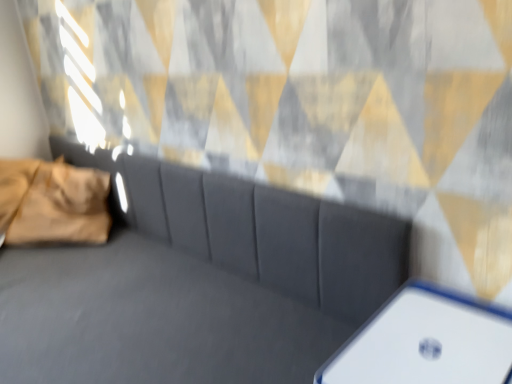
The height and width of the screenshot is (384, 512). What are the coordinates of `golden velvet pillow at left` in the screenshot? It's located at (53, 202).

In the image, is suede gray couch at center on the left side or the right side of white plastic phone at lower right?

suede gray couch at center is to the left of white plastic phone at lower right.

Is suede gray couch at center far from white plastic phone at lower right?

Actually, suede gray couch at center and white plastic phone at lower right are a little close together.

Which is correct: suede gray couch at center is inside white plastic phone at lower right, or outside of it?

suede gray couch at center cannot be found inside white plastic phone at lower right.

Who is shorter, suede gray couch at center or white plastic phone at lower right?

Standing shorter between the two is white plastic phone at lower right.

Considering the sizes of objects golden velvet pillow at left and suede gray couch at center in the image provided, who is bigger, golden velvet pillow at left or suede gray couch at center?

suede gray couch at center.

Considering the positions of objects golden velvet pillow at left and suede gray couch at center in the image provided, who is more to the right, golden velvet pillow at left or suede gray couch at center?

Positioned to the right is suede gray couch at center.

Which is more distant, (68, 193) or (206, 256)?

The point (68, 193) is behind.

Is golden velvet pillow at left facing towards suede gray couch at center?

Yes, golden velvet pillow at left is aimed at suede gray couch at center.

Is suede gray couch at center positioned beyond the bounds of golden velvet pillow at left?

Yes.

Which of these two, suede gray couch at center or golden velvet pillow at left, is wider?

suede gray couch at center is wider.

Who is bigger, suede gray couch at center or golden velvet pillow at left?

suede gray couch at center.

Is suede gray couch at center looking in the opposite direction of golden velvet pillow at left?

Absolutely, suede gray couch at center is directed away from golden velvet pillow at left.

Are white plastic phone at lower right and suede gray couch at center far apart?

No.

In the image, is white plastic phone at lower right positioned in front of or behind suede gray couch at center?

Clearly, white plastic phone at lower right is behind suede gray couch at center.

Is white plastic phone at lower right taller than suede gray couch at center?

Incorrect, the height of white plastic phone at lower right is not larger of that of suede gray couch at center.

Is white plastic phone at lower right situated inside suede gray couch at center or outside?

white plastic phone at lower right is outside suede gray couch at center.

Does white plastic phone at lower right turn towards golden velvet pillow at left?

Yes.

How many degrees apart are the facing directions of white plastic phone at lower right and golden velvet pillow at left?

The angular difference between white plastic phone at lower right and golden velvet pillow at left is 143 degrees.

Who is taller, white plastic phone at lower right or golden velvet pillow at left?

golden velvet pillow at left is taller.

Find the location of a particular element. The width and height of the screenshot is (512, 384). pillow located on the left of white plastic phone at lower right is located at coordinates (53, 202).

Is golden velvet pillow at left to the left of white plastic phone at lower right from the viewer's perspective?

Correct, you'll find golden velvet pillow at left to the left of white plastic phone at lower right.

From the image's perspective, who appears lower, golden velvet pillow at left or white plastic phone at lower right?

white plastic phone at lower right is shown below in the image.

Who is shorter, golden velvet pillow at left or white plastic phone at lower right?

Standing shorter between the two is white plastic phone at lower right.

Which of these two, golden velvet pillow at left or white plastic phone at lower right, is thinner?

white plastic phone at lower right is thinner.

This screenshot has height=384, width=512. In order to click on couch below the white plastic phone at lower right (from a real-world perspective) in this screenshot , I will do `click(197, 283)`.

What are the coordinates of `pillow behind the suede gray couch at center` in the screenshot? It's located at (53, 202).

Considering their positions, is white plastic phone at lower right positioned further to suede gray couch at center than golden velvet pillow at left?

golden velvet pillow at left is positioned further to the anchor suede gray couch at center.

Considering their positions, is suede gray couch at center positioned closer to golden velvet pillow at left than white plastic phone at lower right?

suede gray couch at center is closer to golden velvet pillow at left.

From the image, which object appears to be farther from golden velvet pillow at left, white plastic phone at lower right or suede gray couch at center?

Among the two, white plastic phone at lower right is located further to golden velvet pillow at left.

Looking at the image, which one is located closer to suede gray couch at center, golden velvet pillow at left or white plastic phone at lower right?

white plastic phone at lower right lies closer to suede gray couch at center than the other object.

From the picture: When comparing their distances from white plastic phone at lower right, does suede gray couch at center or golden velvet pillow at left seem closer?

Based on the image, suede gray couch at center appears to be nearer to white plastic phone at lower right.

Looking at the image, which one is located further to white plastic phone at lower right, golden velvet pillow at left or suede gray couch at center?

golden velvet pillow at left lies further to white plastic phone at lower right than the other object.

Image resolution: width=512 pixels, height=384 pixels. Identify the location of couch between golden velvet pillow at left and white plastic phone at lower right in the horizontal direction. (197, 283).